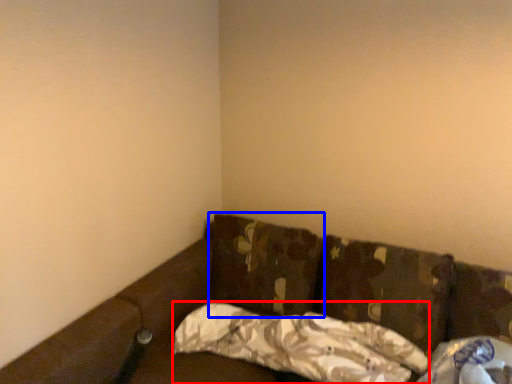
Question: Which of the following is the closest to the observer, pillow (highlighted by a red box) or pillow (highlighted by a blue box)?

Choices:
 (A) pillow
 (B) pillow

Answer: (A)